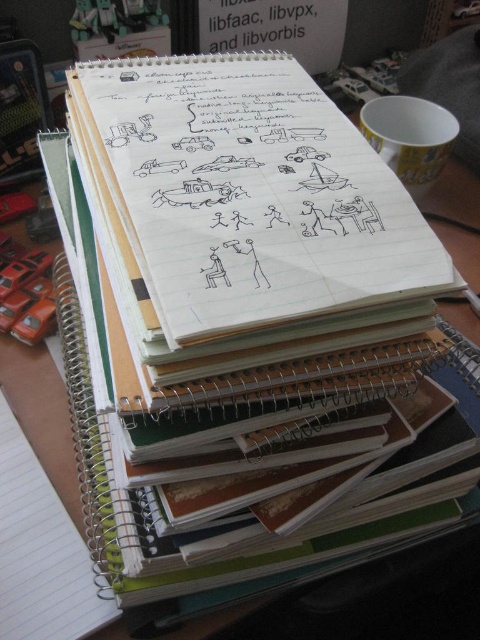
Based on the photo, does white lined paper at center appear on the left side of black paper at upper center?

Correct, you'll find white lined paper at center to the left of black paper at upper center.

Is white lined paper at center above black paper at upper center?

Actually, white lined paper at center is below black paper at upper center.

Find the location of `white lined paper at center`. white lined paper at center is located at coordinates (245, 196).

Find the location of a particular element. The height and width of the screenshot is (640, 480). white lined paper at center is located at coordinates (245, 196).